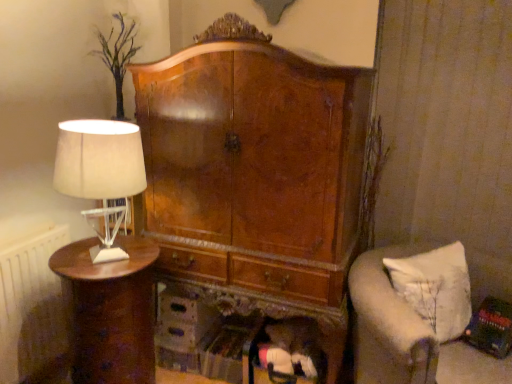
The width and height of the screenshot is (512, 384). I want to click on white fabric cushion at lower right, so click(x=390, y=322).

What do you see at coordinates (111, 311) in the screenshot?
I see `shiny brown wood nightstand at left` at bounding box center [111, 311].

Image resolution: width=512 pixels, height=384 pixels. What are the coordinates of `white fabric lampshade at left` in the screenshot? It's located at (101, 175).

Can you confirm if white fabric cushion at lower right is positioned to the right of white radiator at left?

Correct, you'll find white fabric cushion at lower right to the right of white radiator at left.

Does white fabric cushion at lower right turn towards white radiator at left?

No, white fabric cushion at lower right does not turn towards white radiator at left.

Who is smaller, white fabric cushion at lower right or white radiator at left?

white radiator at left.

From a real-world perspective, is white fabric cushion at lower right above or below white radiator at left?

In terms of real-world spatial position, white fabric cushion at lower right is above white radiator at left.

In terms of size, does white fabric lampshade at left appear bigger or smaller than white radiator at left?

white fabric lampshade at left is smaller than white radiator at left.

Is white fabric lampshade at left behind white radiator at left?

No, white fabric lampshade at left is closer to the camera.

Is white fabric lampshade at left not inside white radiator at left?

Yes.

Is white fabric lampshade at left far from white radiator at left?

That's not correct — white fabric lampshade at left is a little close to white radiator at left.

Considering the relative positions of white radiator at left and shiny brown wood nightstand at left in the image provided, is white radiator at left to the left or to the right of shiny brown wood nightstand at left?

Based on their positions, white radiator at left is located to the left of shiny brown wood nightstand at left.

Considering the relative sizes of white radiator at left and shiny brown wood nightstand at left in the image provided, is white radiator at left smaller than shiny brown wood nightstand at left?

Indeed, white radiator at left has a smaller size compared to shiny brown wood nightstand at left.

Can you see white radiator at left touching shiny brown wood nightstand at left?

No, white radiator at left is not with shiny brown wood nightstand at left.

Is white radiator at left oriented towards shiny brown wood nightstand at left?

Yes, white radiator at left is facing shiny brown wood nightstand at left.

There is a white fabric cushion at lower right. What are the coordinates of `lamp above it (from a real-world perspective)` in the screenshot? It's located at (101, 175).

Considering the points (138, 187) and (440, 245), which point is behind, point (138, 187) or point (440, 245)?

The point (440, 245) is more distant.

Considering the relative sizes of white fabric lampshade at left and white fabric cushion at lower right in the image provided, is white fabric lampshade at left wider than white fabric cushion at lower right?

Correct, the width of white fabric lampshade at left exceeds that of white fabric cushion at lower right.

Based on the photo, from the image's perspective, which is above, white fabric lampshade at left or white fabric cushion at lower right?

From the image's view, white fabric lampshade at left is above.

Does point (355, 277) come in front of point (76, 245)?

Yes.

Is white fabric cushion at lower right to the left of shiny brown wood nightstand at left from the viewer's perspective?

Incorrect, white fabric cushion at lower right is not on the left side of shiny brown wood nightstand at left.

Between white fabric cushion at lower right and shiny brown wood nightstand at left, which one has less height?

white fabric cushion at lower right is shorter.

Which object is closer to the camera taking this photo, white fabric cushion at lower right or shiny brown wood nightstand at left?

shiny brown wood nightstand at left is closer to the camera.

Considering the sizes of objects shiny brown wood nightstand at left and white fabric cushion at lower right in the image provided, who is bigger, shiny brown wood nightstand at left or white fabric cushion at lower right?

shiny brown wood nightstand at left.

Consider the image. Is there a large distance between shiny brown wood nightstand at left and white fabric cushion at lower right?

No.

From a real-world perspective, is shiny brown wood nightstand at left below white fabric cushion at lower right?

Indeed, from a real-world perspective, shiny brown wood nightstand at left is positioned beneath white fabric cushion at lower right.

The height and width of the screenshot is (384, 512). I want to click on lamp above the white radiator at left (from a real-world perspective), so click(x=101, y=175).

From a real-world perspective, relative to white fabric lampshade at left, is white radiator at left vertically above or below?

From a real-world perspective, white radiator at left is physically below white fabric lampshade at left.

Looking at this image, which object is wider, white radiator at left or white fabric lampshade at left?

With larger width is white fabric lampshade at left.

At what (x,y) coordinates should I click in order to perform the action: click on radiator on the left side of white fabric cushion at lower right. Please return your answer as a coordinate pair (x, y). This screenshot has width=512, height=384. Looking at the image, I should click on (30, 301).

What are the coordinates of `lamp above the white radiator at left (from the image's perspective)` in the screenshot? It's located at (101, 175).

Based on their spatial positions, is white fabric cushion at lower right or white fabric lampshade at left further from white radiator at left?

Based on the image, white fabric cushion at lower right appears to be further to white radiator at left.

Considering their positions, is white radiator at left positioned further to shiny brown wood nightstand at left than white fabric lampshade at left?

Based on the image, white radiator at left appears to be further to shiny brown wood nightstand at left.

Estimate the real-world distances between objects in this image. Which object is closer to shiny brown wood nightstand at left, white fabric cushion at lower right or white fabric lampshade at left?

white fabric lampshade at left lies closer to shiny brown wood nightstand at left than the other object.

Estimate the real-world distances between objects in this image. Which object is closer to shiny brown wood nightstand at left, white fabric lampshade at left or white radiator at left?

white fabric lampshade at left.

Based on their spatial positions, is white fabric lampshade at left or white fabric cushion at lower right closer to white radiator at left?

Based on the image, white fabric lampshade at left appears to be nearer to white radiator at left.

From the picture: Based on their spatial positions, is shiny brown wood nightstand at left or white fabric cushion at lower right closer to white radiator at left?

The object closer to white radiator at left is shiny brown wood nightstand at left.

Which object lies nearer to the anchor point white fabric lampshade at left, white radiator at left or white fabric cushion at lower right?

The object closer to white fabric lampshade at left is white radiator at left.

Considering their positions, is white fabric cushion at lower right positioned closer to white radiator at left than shiny brown wood nightstand at left?

shiny brown wood nightstand at left.

The image size is (512, 384). I want to click on nightstand between white radiator at left and white fabric cushion at lower right from left to right, so [111, 311].

Identify the location of lamp situated between white radiator at left and white fabric cushion at lower right from left to right. This screenshot has height=384, width=512. (101, 175).

Locate an element on the screen. lamp between shiny brown wood nightstand at left and white fabric cushion at lower right is located at coordinates (101, 175).

Find the location of a particular element. The width and height of the screenshot is (512, 384). radiator between white fabric lampshade at left and shiny brown wood nightstand at left in the vertical direction is located at coordinates (30, 301).